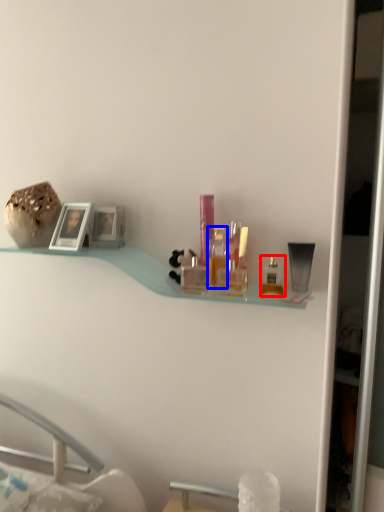
Question: Which point is further to the camera, toiletry (highlighted by a red box) or toiletry (highlighted by a blue box)?

Choices:
 (A) toiletry
 (B) toiletry

Answer: (B)